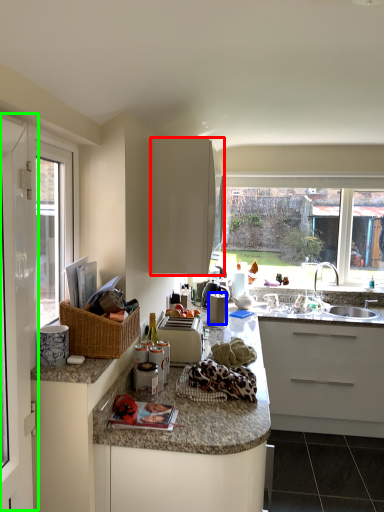
Question: Based on their relative distances, which object is farther from cabinetry (highlighted by a red box)? Choose from appliance (highlighted by a blue box) and screen door (highlighted by a green box).

Choices:
 (A) appliance
 (B) screen door

Answer: (B)